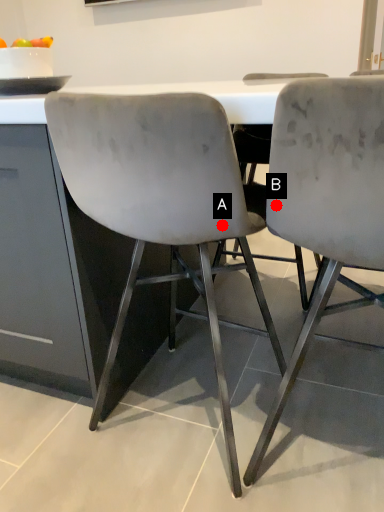
Question: Two points are circled on the image, labeled by A and B beside each circle. Which point is farther to the camera?

Choices:
 (A) A is further
 (B) B is further

Answer: (A)